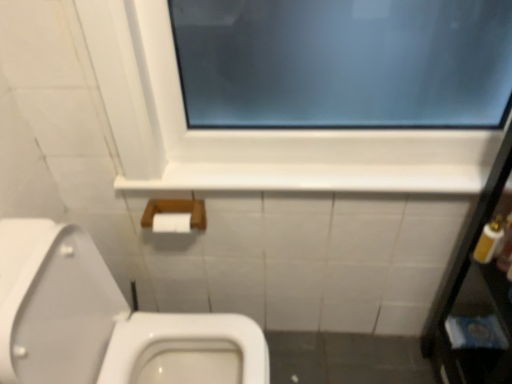
Question: Considering the relative positions of white glossy ledge at upper center and white plastic bottle at right, the first toiletry when ordered from left to right, in the image provided, is white glossy ledge at upper center to the right of white plastic bottle at right, the first toiletry when ordered from left to right, from the viewer's perspective?

Choices:
 (A) no
 (B) yes

Answer: (A)

Question: Can you confirm if white glossy ledge at upper center is taller than white plastic bottle at right, the first toiletry when ordered from left to right?

Choices:
 (A) no
 (B) yes

Answer: (A)

Question: From the image's perspective, is white glossy ledge at upper center on top of white plastic bottle at right, arranged as the 2th toiletry when viewed from the right?

Choices:
 (A) yes
 (B) no

Answer: (A)

Question: Considering the relative sizes of white glossy ledge at upper center and white plastic bottle at right, the first toiletry when ordered from left to right, in the image provided, is white glossy ledge at upper center smaller than white plastic bottle at right, the first toiletry when ordered from left to right,?

Choices:
 (A) no
 (B) yes

Answer: (A)

Question: Can you confirm if white glossy ledge at upper center is bigger than white plastic bottle at right, arranged as the 2th toiletry when viewed from the right?

Choices:
 (A) no
 (B) yes

Answer: (B)

Question: From a real-world perspective, relative to white glossy ledge at upper center, is white plastic bottle at right, arranged as the 2th toiletry when viewed from the right, vertically above or below?

Choices:
 (A) above
 (B) below

Answer: (B)

Question: Choose the correct answer: Is white plastic bottle at right, arranged as the 2th toiletry when viewed from the right, inside white glossy ledge at upper center or outside it?

Choices:
 (A) outside
 (B) inside

Answer: (A)

Question: From the image's perspective, relative to white glossy ledge at upper center, is white plastic bottle at right, the first toiletry when ordered from left to right, above or below?

Choices:
 (A) above
 (B) below

Answer: (B)

Question: Based on their positions, is white plastic bottle at right, the first toiletry when ordered from left to right, located to the left or right of white glossy ledge at upper center?

Choices:
 (A) right
 (B) left

Answer: (A)

Question: Is white glossy toilet at lower left inside the boundaries of white plastic bottle at right, the first toiletry when ordered from left to right, or outside?

Choices:
 (A) inside
 (B) outside

Answer: (B)

Question: Is white glossy toilet at lower left taller or shorter than white plastic bottle at right, arranged as the 2th toiletry when viewed from the right?

Choices:
 (A) tall
 (B) short

Answer: (A)

Question: Is white glossy toilet at lower left bigger or smaller than white plastic bottle at right, arranged as the 2th toiletry when viewed from the right?

Choices:
 (A) big
 (B) small

Answer: (A)

Question: In terms of width, does white glossy toilet at lower left look wider or thinner when compared to white plastic bottle at right, the first toiletry when ordered from left to right?

Choices:
 (A) thin
 (B) wide

Answer: (B)

Question: Which is correct: white plastic bottle at right, arranged as the 2th toiletry when viewed from the right, is inside metallic silver mirror at right, or outside of it?

Choices:
 (A) inside
 (B) outside

Answer: (A)

Question: Considering the positions of point (485, 240) and point (495, 158), is point (485, 240) closer or farther from the camera than point (495, 158)?

Choices:
 (A) closer
 (B) farther

Answer: (A)